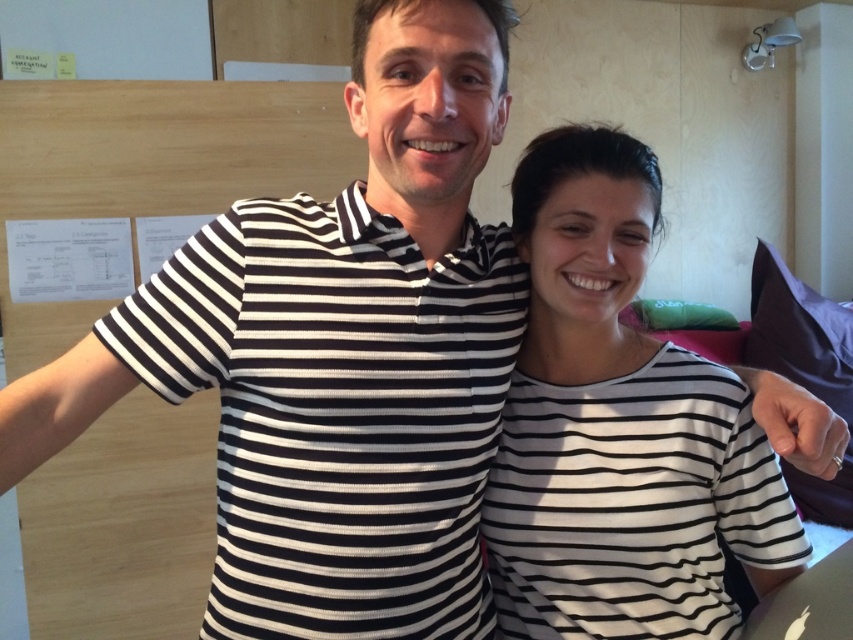
Question: Does black striped polo shirt at center have a smaller size compared to white striped shirt at center?

Choices:
 (A) yes
 (B) no

Answer: (B)

Question: Does black striped polo shirt at center appear on the right side of white striped shirt at center?

Choices:
 (A) yes
 (B) no

Answer: (B)

Question: Considering the relative positions of black striped polo shirt at center and white striped shirt at center in the image provided, where is black striped polo shirt at center located with respect to white striped shirt at center?

Choices:
 (A) below
 (B) above

Answer: (A)

Question: Which point is farther to the camera?

Choices:
 (A) (782, 508)
 (B) (444, 300)

Answer: (A)